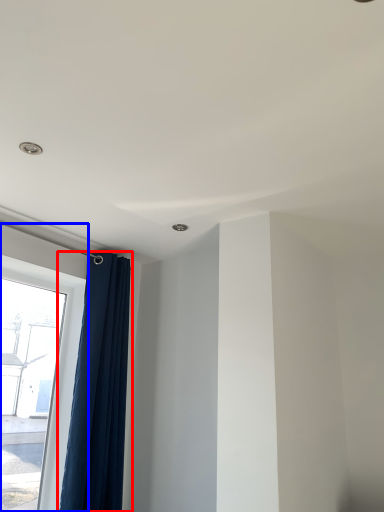
Question: Which of the following is the closest to the observer, curtain (highlighted by a red box) or window (highlighted by a blue box)?

Choices:
 (A) curtain
 (B) window

Answer: (B)